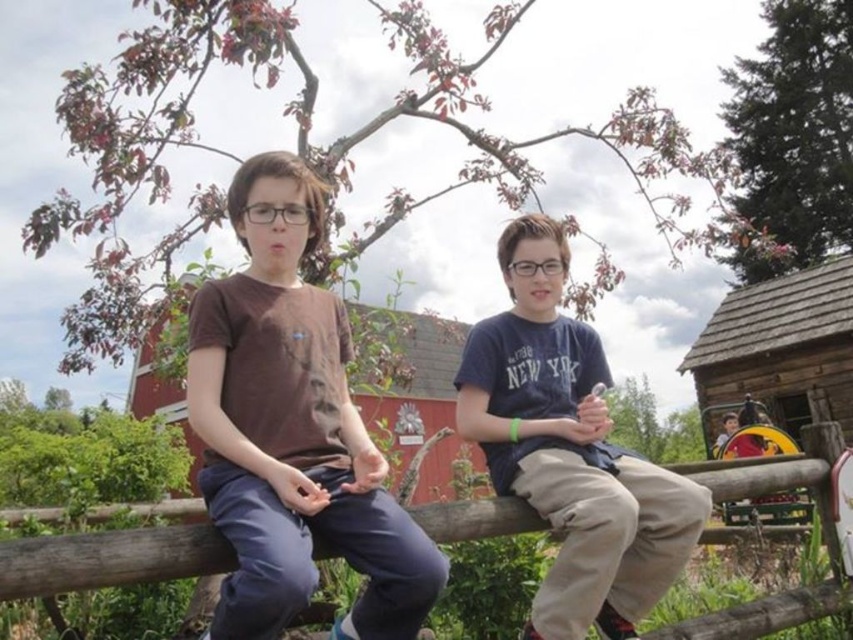
Question: Is brown matte t-shirt at left to the left of wooden at center from the viewer's perspective?

Choices:
 (A) yes
 (B) no

Answer: (A)

Question: Can you confirm if brown matte t-shirt at left is bigger than blue cotton shirt at center?

Choices:
 (A) yes
 (B) no

Answer: (B)

Question: Is blue cotton shirt at center thinner than wooden at center?

Choices:
 (A) yes
 (B) no

Answer: (A)

Question: Estimate the real-world distances between objects in this image. Which object is farther from the wooden at center?

Choices:
 (A) brown matte t-shirt at left
 (B) blue cotton shirt at center

Answer: (A)

Question: Which object appears farthest from the camera in this image?

Choices:
 (A) brown matte t-shirt at left
 (B) wooden at center

Answer: (B)

Question: Which object is positioned farthest from the blue cotton shirt at center?

Choices:
 (A) wooden at center
 (B) brown matte t-shirt at left

Answer: (B)